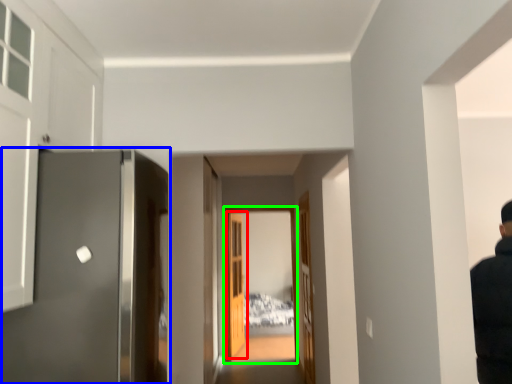
Question: Based on their relative distances, which object is farther from door (highlighted by a red box)? Choose from door (highlighted by a blue box) and glass door (highlighted by a green box).

Choices:
 (A) door
 (B) glass door

Answer: (A)